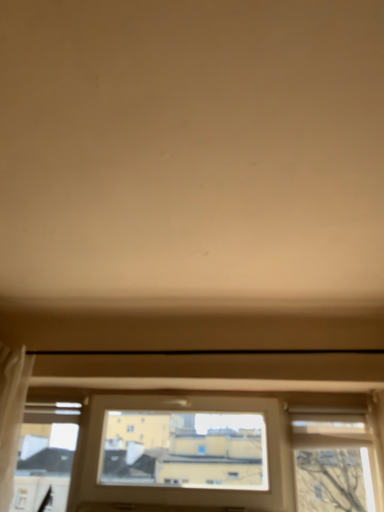
Locate an element on the screen. This screenshot has width=384, height=512. transparent glass window at bottom is located at coordinates (x=202, y=453).

Describe the element at coordinates (202, 453) in the screenshot. I see `transparent glass window at bottom` at that location.

This screenshot has height=512, width=384. What do you see at coordinates (11, 413) in the screenshot?
I see `white sheer curtain at left` at bounding box center [11, 413].

Identify the location of white sheer curtain at left. (11, 413).

In order to face white sheer curtain at left, should I rotate leftwards or rightwards?

To align with it, rotate left about 25.145°.

At what (x,y) coordinates should I click in order to perform the action: click on transparent glass window at bottom. Please return your answer as a coordinate pair (x, y). The image size is (384, 512). Looking at the image, I should click on (202, 453).

Can you confirm if transparent glass window at bottom is positioned to the right of white sheer curtain at left?

Indeed, transparent glass window at bottom is positioned on the right side of white sheer curtain at left.

Consider the image. Relative to white sheer curtain at left, is transparent glass window at bottom in front or behind?

Clearly, transparent glass window at bottom is behind white sheer curtain at left.

Is point (15, 495) behind point (1, 493)?

Yes, it is behind point (1, 493).

From the image's perspective, is transparent glass window at bottom located above or below white sheer curtain at left?

transparent glass window at bottom is below white sheer curtain at left.

From a real-world perspective, is transparent glass window at bottom located beneath white sheer curtain at left?

Correct, in the physical world, transparent glass window at bottom is lower than white sheer curtain at left.

Does transparent glass window at bottom have a greater width compared to white sheer curtain at left?

No.

Based on the photo, which of these two, transparent glass window at bottom or white sheer curtain at left, stands taller?

Standing taller between the two is white sheer curtain at left.

Is transparent glass window at bottom bigger or smaller than white sheer curtain at left?

Considering their sizes, transparent glass window at bottom takes up more space than white sheer curtain at left.

Which is correct: transparent glass window at bottom is inside white sheer curtain at left, or outside of it?

transparent glass window at bottom lies outside white sheer curtain at left.

Is transparent glass window at bottom not close to white sheer curtain at left?

Actually, transparent glass window at bottom and white sheer curtain at left are a little close together.

Is transparent glass window at bottom facing away from white sheer curtain at left?

transparent glass window at bottom does not have its back to white sheer curtain at left.

The image size is (384, 512). Find the location of `curtain above the transparent glass window at bottom (from a real-world perspective)`. curtain above the transparent glass window at bottom (from a real-world perspective) is located at coordinates (11, 413).

Looking at this image, would you say white sheer curtain at left is to the left or to the right of transparent glass window at bottom in the picture?

Based on their positions, white sheer curtain at left is located to the left of transparent glass window at bottom.

Is the depth of white sheer curtain at left less than that of transparent glass window at bottom?

Yes, white sheer curtain at left is in front of transparent glass window at bottom.

Considering the points (26, 392) and (360, 467), which point is in front, point (26, 392) or point (360, 467)?

The point (360, 467) is closer to the camera.

From the image's perspective, which object appears higher, white sheer curtain at left or transparent glass window at bottom?

white sheer curtain at left, from the image's perspective.

From a real-world perspective, who is located lower, white sheer curtain at left or transparent glass window at bottom?

From a 3D spatial view, transparent glass window at bottom is below.

Between white sheer curtain at left and transparent glass window at bottom, which one has smaller width?

transparent glass window at bottom is thinner.

Which of these two, white sheer curtain at left or transparent glass window at bottom, stands taller?

white sheer curtain at left is taller.

Can you confirm if white sheer curtain at left is smaller than transparent glass window at bottom?

Correct, white sheer curtain at left occupies less space than transparent glass window at bottom.

Which is correct: white sheer curtain at left is inside transparent glass window at bottom, or outside of it?

white sheer curtain at left is not inside transparent glass window at bottom, it's outside.

Would you consider white sheer curtain at left to be distant from transparent glass window at bottom?

No, white sheer curtain at left is in close proximity to transparent glass window at bottom.

Is white sheer curtain at left facing towards transparent glass window at bottom?

No.

How far apart are white sheer curtain at left and transparent glass window at bottom?

26.68 inches.

Locate an element on the screen. This screenshot has width=384, height=512. window to the right of white sheer curtain at left is located at coordinates (202, 453).

Identify the location of window that is below the white sheer curtain at left (from the image's perspective). 202,453.

The image size is (384, 512). In order to click on curtain on the left of transparent glass window at bottom in this screenshot , I will do `click(11, 413)`.